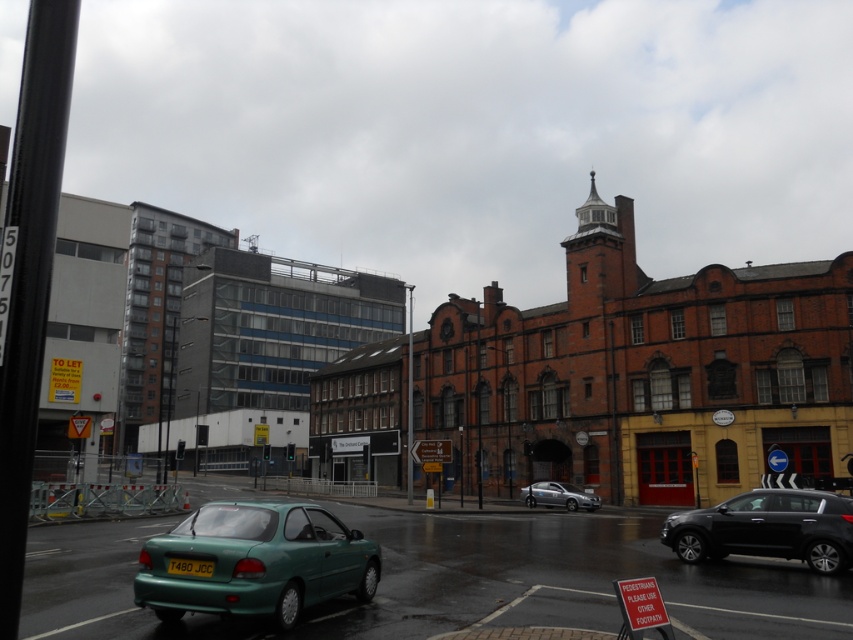
You are a delivery driver who needs to park your vehicle in this area. The teal glossy hatchback at center is currently occupying a parking spot. Can you estimate its current position to determine if there is enough space for your vehicle?

The teal glossy hatchback at center is located at coordinates (x=256, y=561), so you can use this information to calculate the available space for your vehicle.

You are a pedestrian standing at the crosswalk and see the shiny black suv at lower right and the yellow matte license plate at lower center. Which object is closer to you?

The shiny black suv at lower right is closer to you because the yellow matte license plate at lower center is behind it.

You are a delivery driver who needs to park your vehicle between the shiny black suv at lower right and the yellow matte license plate at lower center. Can you safely park there without blocking the license plate?

The shiny black suv at lower right is positioned under the yellow matte license plate at lower center, so parking between them might block the license plate. Choose another spot.